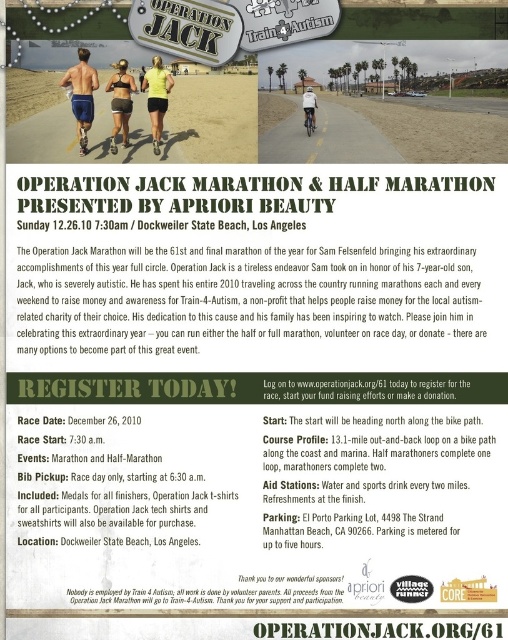
Question: Which point is farther from the camera taking this photo?

Choices:
 (A) (114, 108)
 (B) (314, 116)
 (C) (78, 104)

Answer: (B)

Question: Which object is positioned closest to the matte black sports bra at center?

Choices:
 (A) matte blue shorts at center
 (B) white matte helmet at upper center
 (C) yellow matte shirt at center

Answer: (C)

Question: Is matte blue shorts at center bigger than yellow matte shirt at center?

Choices:
 (A) yes
 (B) no

Answer: (B)

Question: Does yellow matte shirt at center appear under white matte helmet at upper center?

Choices:
 (A) no
 (B) yes

Answer: (B)

Question: Which of the following is the closest to the observer?

Choices:
 (A) matte blue shorts at center
 (B) matte black sports bra at center

Answer: (A)

Question: Is matte blue shorts at center closer to the viewer compared to white matte helmet at upper center?

Choices:
 (A) no
 (B) yes

Answer: (B)